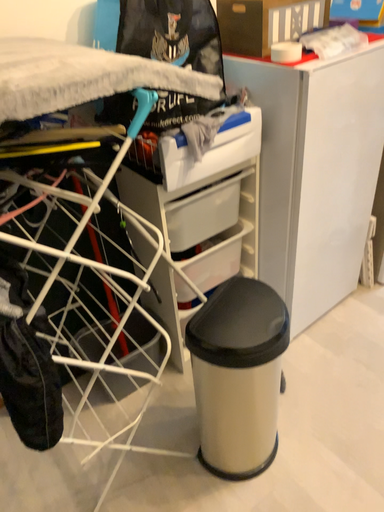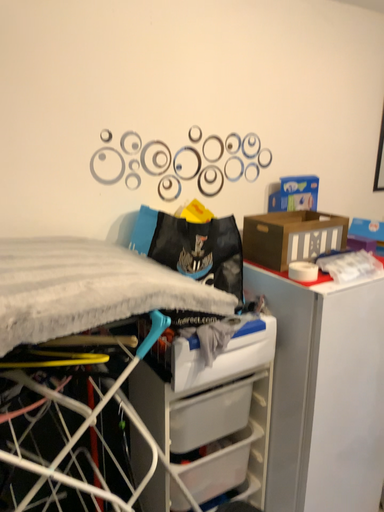
Question: How did the camera likely rotate when shooting the video?

Choices:
 (A) rotated upward
 (B) rotated downward

Answer: (A)